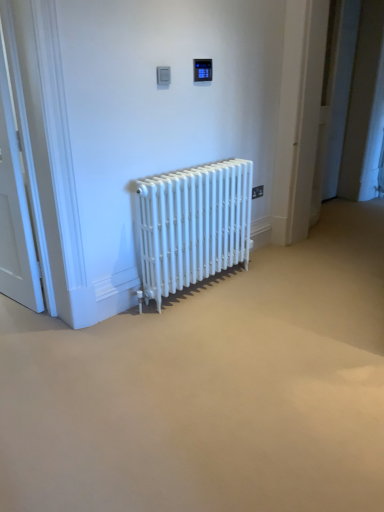
Question: In terms of size, does white wooden door at left appear bigger or smaller than black plastic electric outlet at upper center?

Choices:
 (A) small
 (B) big

Answer: (B)

Question: Considering the positions of white wooden door at left and black plastic electric outlet at upper center in the image, is white wooden door at left taller or shorter than black plastic electric outlet at upper center?

Choices:
 (A) tall
 (B) short

Answer: (A)

Question: Based on their relative distances, which object is farther from the white wooden door at left?

Choices:
 (A) white matte radiator at center
 (B) black plastic electric outlet at upper center

Answer: (B)

Question: Which of these objects is positioned closest to the black plastic electric outlet at upper center?

Choices:
 (A) white wooden door at left
 (B) white matte radiator at center

Answer: (B)